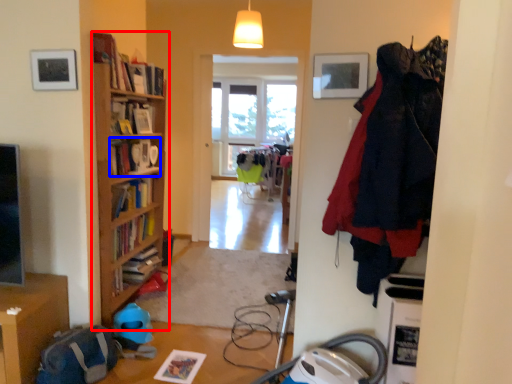
Question: Which object is further to the camera taking this photo, bookcase (highlighted by a red box) or book (highlighted by a blue box)?

Choices:
 (A) bookcase
 (B) book

Answer: (B)